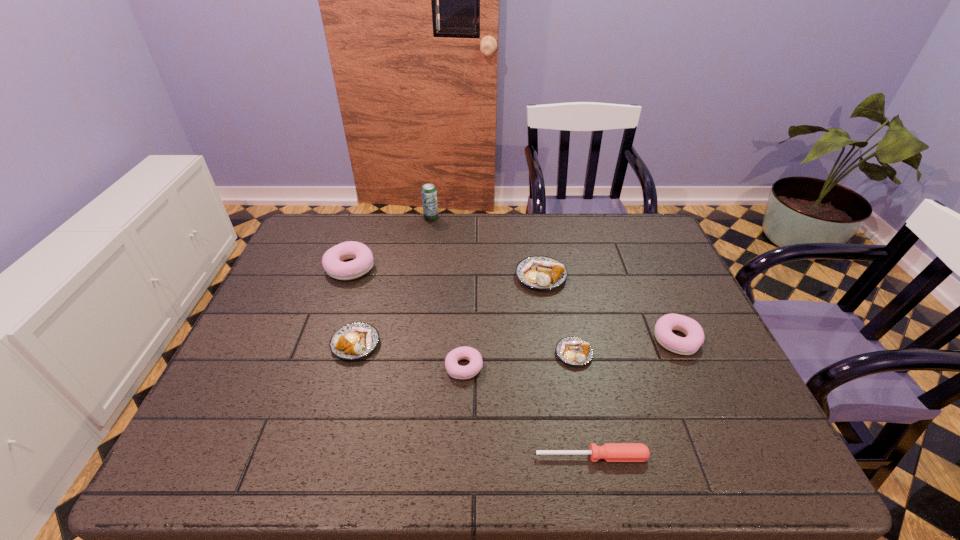
The width and height of the screenshot is (960, 540). What are the coordinates of `vacant region at the far left corner` in the screenshot? It's located at (316, 247).

You are a GUI agent. You are given a task and a screenshot of the screen. Output one action in this format:
    pyautogui.click(x=<x>, y=<y>)
    Task: Click on the vacant space at the near left corner
    
    Given the screenshot: What is the action you would take?
    pyautogui.click(x=203, y=460)

Locate an element on the screen. The image size is (960, 540). free space at the far right corner of the desktop is located at coordinates (662, 235).

I want to click on free space between the farthest brown pastry and the biggest pink pastry, so click(x=445, y=272).

In order to click on free space that is in between the farthest brown pastry and the farthest pink pastry in this screenshot , I will do `click(445, 272)`.

Find the location of a particular element. unoccupied position between the farthest brown pastry and the nearest object is located at coordinates (566, 367).

Where is `empty location between the screwdriver and the biggest brown pastry`? empty location between the screwdriver and the biggest brown pastry is located at coordinates (566, 367).

At what (x,y) coordinates should I click in order to perform the action: click on free spot between the farthest brown pastry and the rightmost object. Please return your answer as a coordinate pair (x, y). Looking at the image, I should click on (609, 308).

The height and width of the screenshot is (540, 960). What are the coordinates of `free spot between the rightmost object and the biggest brown pastry` in the screenshot? It's located at (609, 308).

Locate an element on the screen. The width and height of the screenshot is (960, 540). unoccupied area between the smallest brown pastry and the farthest brown pastry is located at coordinates (558, 315).